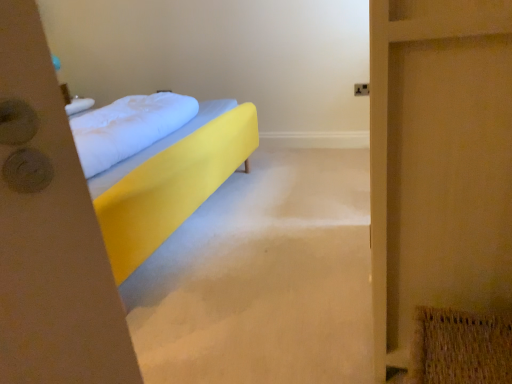
Question: From a real-world perspective, does white soft pillow at center stand above yellow fabric bed at center?

Choices:
 (A) yes
 (B) no

Answer: (A)

Question: Is white soft pillow at center in front of yellow fabric bed at center?

Choices:
 (A) no
 (B) yes

Answer: (A)

Question: Can you confirm if white soft pillow at center is taller than yellow fabric bed at center?

Choices:
 (A) yes
 (B) no

Answer: (B)

Question: Can you see white soft pillow at center touching yellow fabric bed at center?

Choices:
 (A) no
 (B) yes

Answer: (A)

Question: Is white soft pillow at center facing towards yellow fabric bed at center?

Choices:
 (A) yes
 (B) no

Answer: (A)

Question: Is white soft pillow at center located outside yellow fabric bed at center?

Choices:
 (A) yes
 (B) no

Answer: (B)

Question: Considering the relative sizes of wooden screen door at right and white soft pillow at center in the image provided, is wooden screen door at right bigger than white soft pillow at center?

Choices:
 (A) yes
 (B) no

Answer: (A)

Question: Considering the relative positions of wooden screen door at right and white soft pillow at center in the image provided, is wooden screen door at right in front of white soft pillow at center?

Choices:
 (A) yes
 (B) no

Answer: (A)

Question: Can you confirm if wooden screen door at right is positioned to the right of white soft pillow at center?

Choices:
 (A) no
 (B) yes

Answer: (B)

Question: Is wooden screen door at right smaller than white soft pillow at center?

Choices:
 (A) no
 (B) yes

Answer: (A)

Question: From a real-world perspective, is wooden screen door at right positioned under white soft pillow at center based on gravity?

Choices:
 (A) yes
 (B) no

Answer: (A)

Question: Can we say wooden screen door at right lies outside white soft pillow at center?

Choices:
 (A) yes
 (B) no

Answer: (A)

Question: From the image's perspective, is yellow fabric bed at center on top of white soft pillow at center?

Choices:
 (A) yes
 (B) no

Answer: (B)